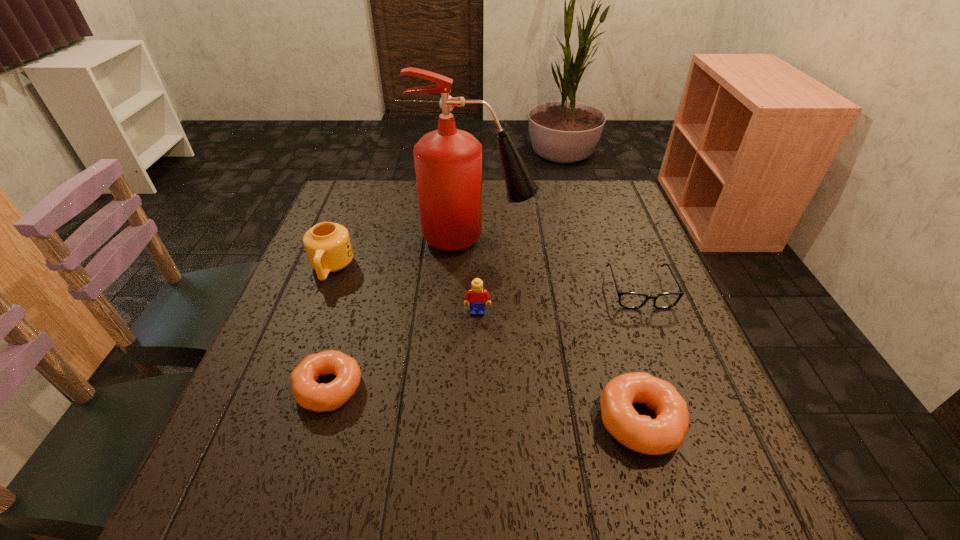
Where is `vacant region located 0.230m on the front-facing side of the spectacles`? vacant region located 0.230m on the front-facing side of the spectacles is located at coordinates (683, 401).

Where is `vacant area situated 0.130m on the handle side of the mug`? vacant area situated 0.130m on the handle side of the mug is located at coordinates (308, 330).

The width and height of the screenshot is (960, 540). I want to click on vacant space located on the front-facing side of the Lego, so click(x=477, y=429).

Where is `object that is at the far edge`? object that is at the far edge is located at coordinates (448, 162).

Image resolution: width=960 pixels, height=540 pixels. Identify the location of doughnut situated at the left edge. (309, 394).

Identify the location of mug that is at the left edge. This screenshot has width=960, height=540. (328, 247).

I want to click on doughnut positioned at the right edge, so click(x=667, y=432).

At what (x,y) coordinates should I click in order to perform the action: click on spectacles located in the right edge section of the desktop. Please return your answer as a coordinate pair (x, y). Looking at the image, I should click on (632, 300).

Where is `object present at the near left corner`? This screenshot has width=960, height=540. object present at the near left corner is located at coordinates (309, 394).

Find the location of a particular element. This screenshot has height=540, width=960. object that is at the near right corner is located at coordinates (667, 432).